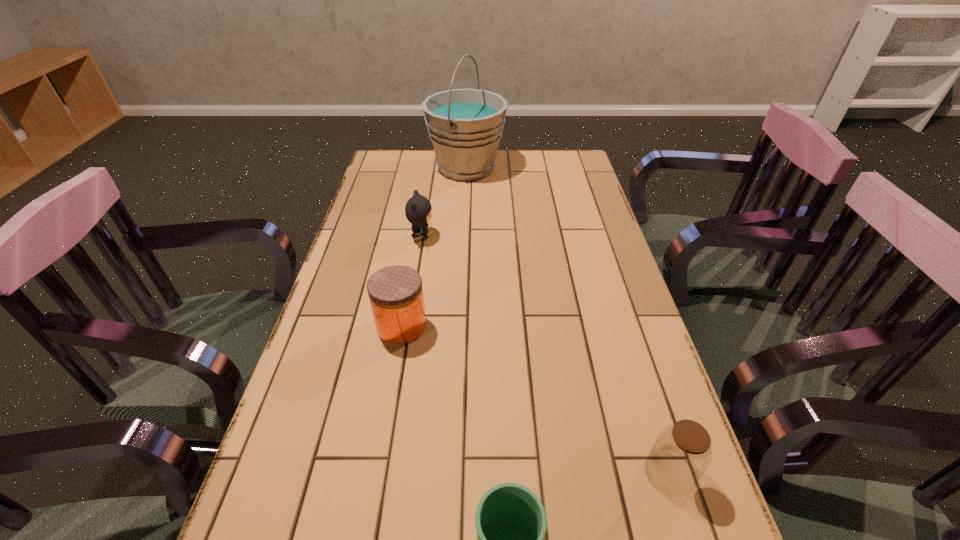
In order to click on object positioned at the far edge in this screenshot , I will do `click(465, 126)`.

Find the location of a particular element. The width and height of the screenshot is (960, 540). object positioned at the left edge is located at coordinates (396, 295).

The width and height of the screenshot is (960, 540). What are the coordinates of `object situated at the right edge` in the screenshot? It's located at (681, 454).

Locate an element on the screen. vacant space at the far edge of the desktop is located at coordinates (436, 179).

In the image, there is a desktop. Where is `vacant area at the left edge`? The image size is (960, 540). vacant area at the left edge is located at coordinates (325, 443).

This screenshot has height=540, width=960. Find the location of `free space at the right edge of the desktop`. free space at the right edge of the desktop is located at coordinates (622, 309).

In the image, there is a desktop. Where is `free region at the far right corner`? free region at the far right corner is located at coordinates (541, 159).

Find the location of a particular element. This screenshot has height=540, width=960. vacant space in between the tallest object and the kitten is located at coordinates (444, 202).

Locate an element on the screen. This screenshot has width=960, height=540. empty location between the left jar and the fourth farthest object is located at coordinates (536, 400).

This screenshot has height=540, width=960. Identify the location of vacant space in between the second farthest object and the nearer jar. (545, 355).